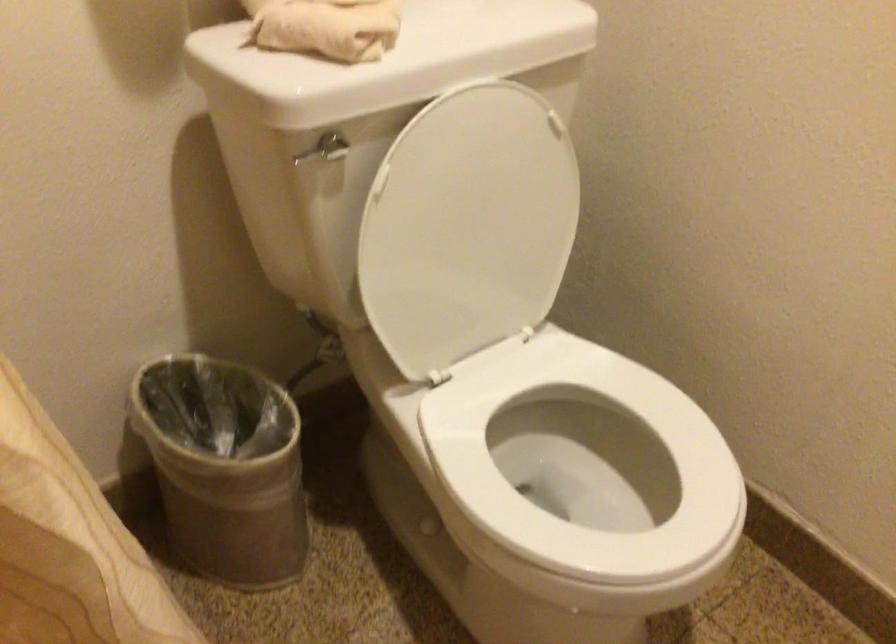
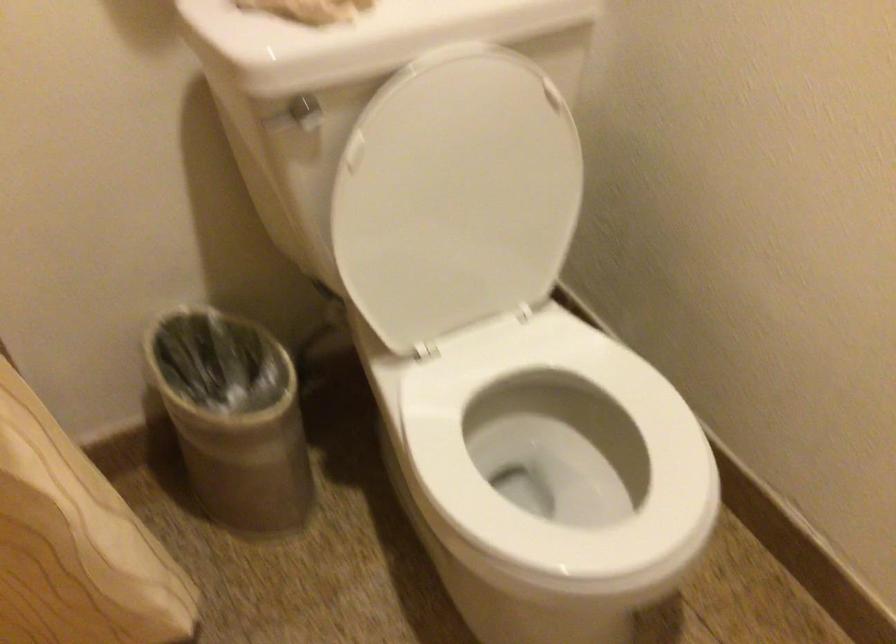
Question: The images are taken continuously from a first-person perspective. In which direction are you moving?

Choices:
 (A) Left
 (B) Right
 (C) Forward
 (D) Backward

Answer: (B)